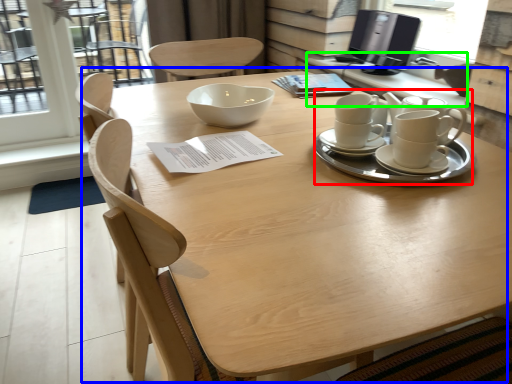
Question: Which object is the farthest from tea set (highlighted by a red box)? Choose among these: table (highlighted by a blue box) or table (highlighted by a green box).

Choices:
 (A) table
 (B) table

Answer: (B)